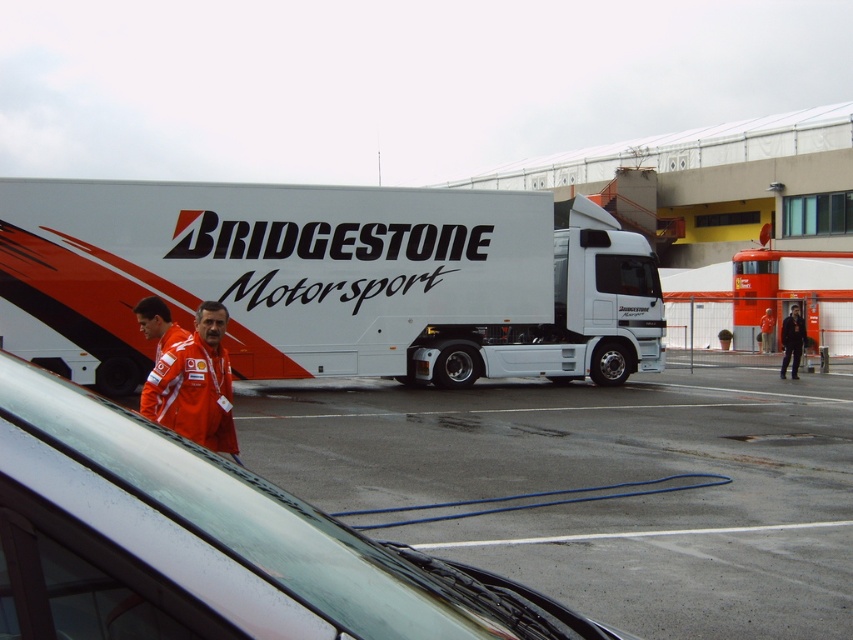
Question: Is orange fabric jacket at lower center thinner than black leather jacket at center?

Choices:
 (A) no
 (B) yes

Answer: (A)

Question: Which of the following is the farthest from the observer?

Choices:
 (A) black leather jacket at center
 (B) orange fabric jacket at center

Answer: (B)

Question: Which of the following is the farthest from the observer?

Choices:
 (A) (163, 384)
 (B) (770, 324)
 (C) (561, 618)

Answer: (B)

Question: Can you confirm if orange fabric jacket at lower center is wider than transparent glass windshield at center?

Choices:
 (A) yes
 (B) no

Answer: (B)

Question: Does orange fabric jacket at lower center have a smaller size compared to orange fabric jacket at center?

Choices:
 (A) no
 (B) yes

Answer: (A)

Question: Which point is farther from the camera taking this photo?

Choices:
 (A) (44, 390)
 (B) (761, 332)
 (C) (790, 332)
 (D) (614, 272)

Answer: (B)